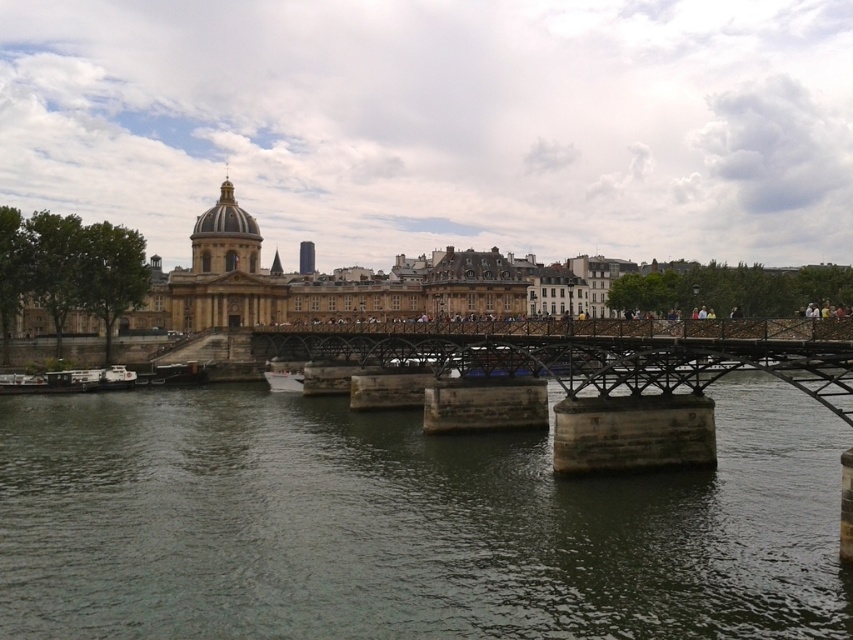
Who is positioned more to the right, dark gray concrete river at center or metallic bridge at center?

metallic bridge at center is more to the right.

The image size is (853, 640). What do you see at coordinates (405, 524) in the screenshot?
I see `dark gray concrete river at center` at bounding box center [405, 524].

Find the location of a particular element. The height and width of the screenshot is (640, 853). dark gray concrete river at center is located at coordinates (405, 524).

Is dark gray concrete river at center to the left of white glossy boat at center from the viewer's perspective?

No, dark gray concrete river at center is not to the left of white glossy boat at center.

Does point (131, 499) come behind point (300, 371)?

No, (131, 499) is closer to viewer.

Which is behind, point (701, 544) or point (273, 376)?

Positioned behind is point (273, 376).

At what (x,y) coordinates should I click in order to perform the action: click on dark gray concrete river at center. Please return your answer as a coordinate pair (x, y). This screenshot has width=853, height=640. Looking at the image, I should click on (405, 524).

Does metallic bridge at center have a greater height compared to white glossy boat at center?

Yes.

Which is more to the right, metallic bridge at center or white glossy boat at center?

metallic bridge at center is more to the right.

Locate an element on the screen. This screenshot has height=640, width=853. metallic bridge at center is located at coordinates (595, 352).